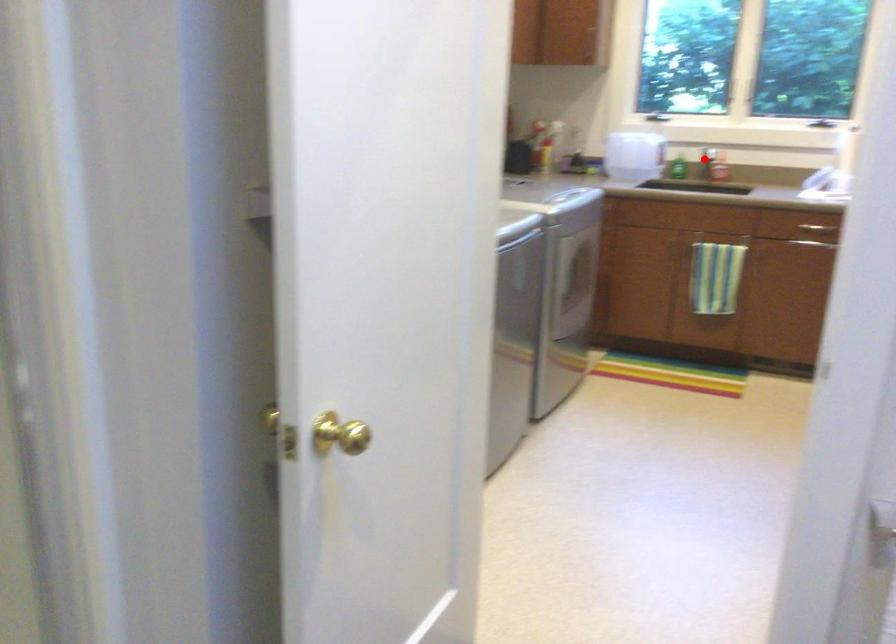
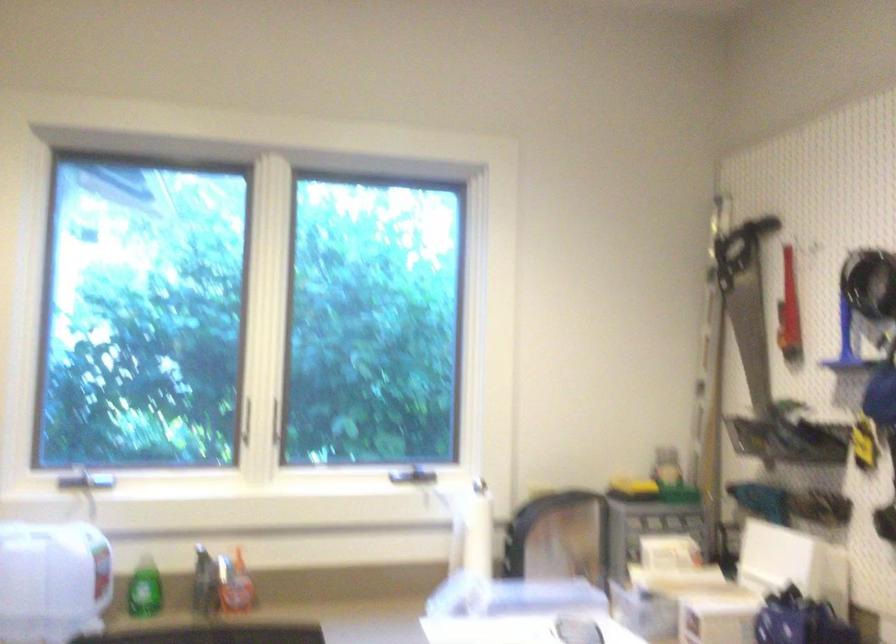
Find the pixel in the second image that matches the highlighted location in the first image.

(204, 583)